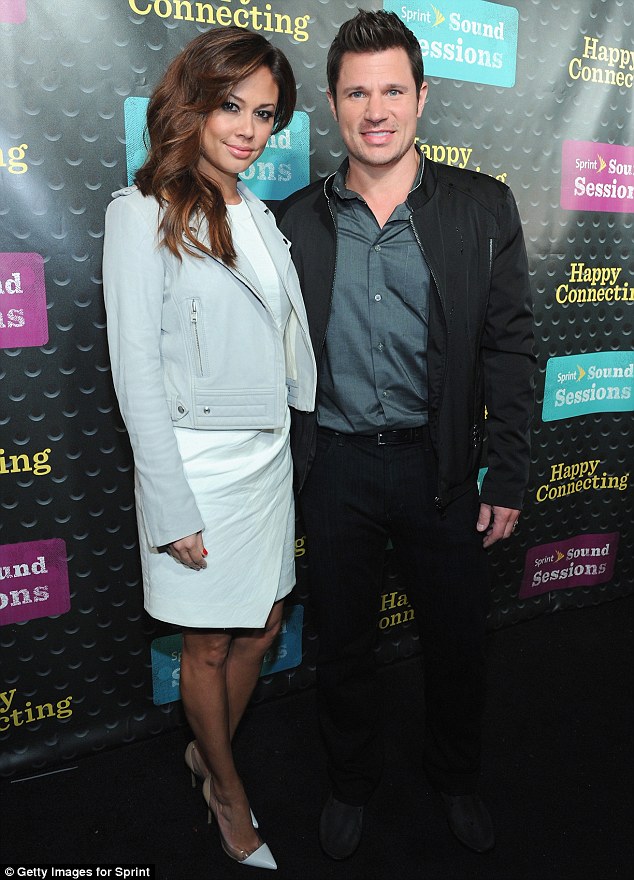
You are a GUI agent. You are given a task and a screenshot of the screen. Output one action in this format:
    pyautogui.click(x=<x>, y=<y>)
    Task: Click on the black wall
    Image resolution: width=634 pixels, height=880 pixels.
    Given the screenshot: What is the action you would take?
    pyautogui.click(x=78, y=99)